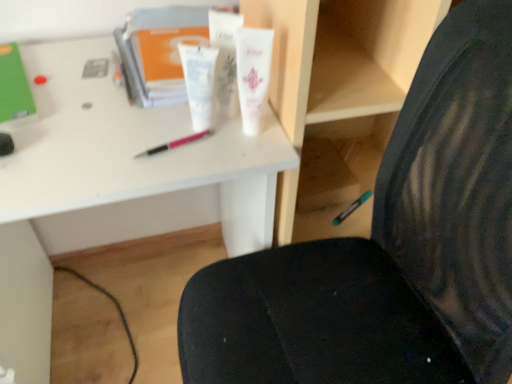
Locate an element on the screen. This screenshot has width=512, height=384. free spot in front of white glossy lotion at center, which ranks as the 2th toiletry in left-to-right order is located at coordinates (205, 156).